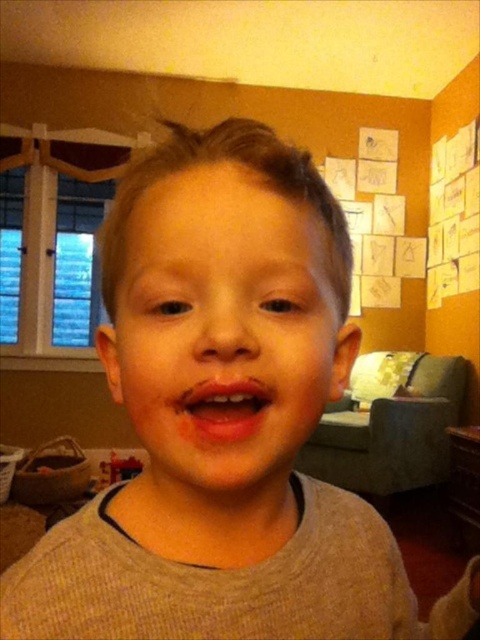
Question: Which object is farther from the camera taking this photo?

Choices:
 (A) smooth skin face at center
 (B) bright red lips at center

Answer: (B)

Question: Can you confirm if smooth skin face at center is bigger than bright red lips at center?

Choices:
 (A) yes
 (B) no

Answer: (A)

Question: Does smooth skin face at center appear under bright red lips at center?

Choices:
 (A) yes
 (B) no

Answer: (B)

Question: Is smooth skin face at center in front of bright red lips at center?

Choices:
 (A) no
 (B) yes

Answer: (B)

Question: Among these points, which one is farthest from the camera?

Choices:
 (A) (207, 436)
 (B) (269, 460)

Answer: (B)